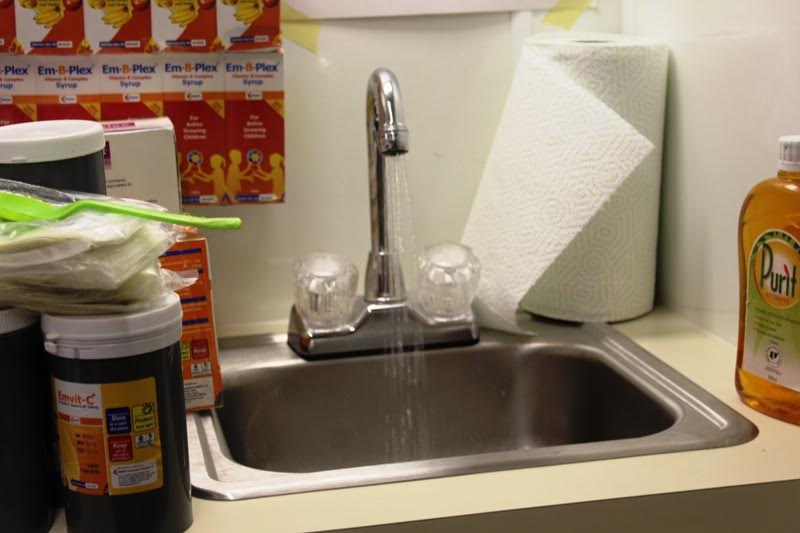
This screenshot has width=800, height=533. What are the coordinates of `box` in the screenshot? It's located at click(252, 129).